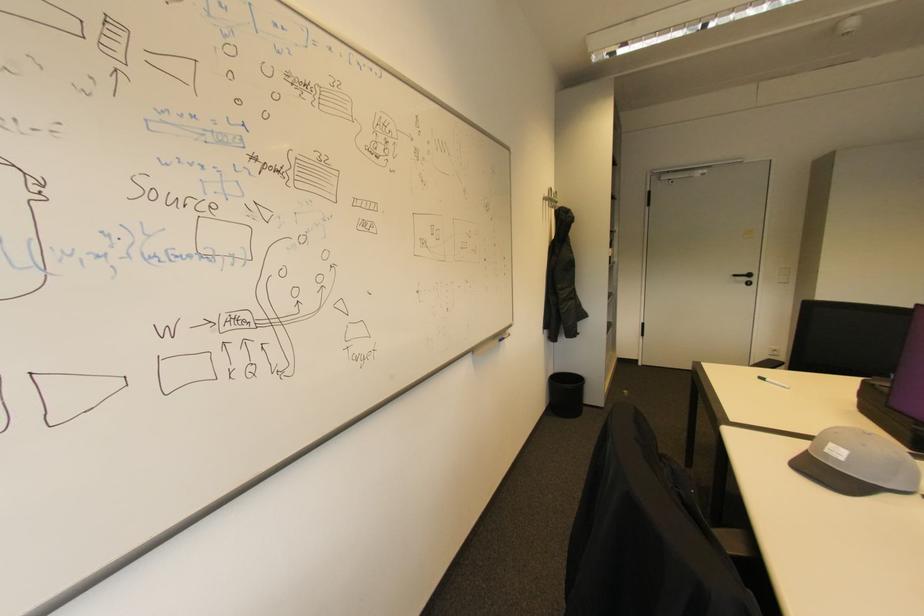
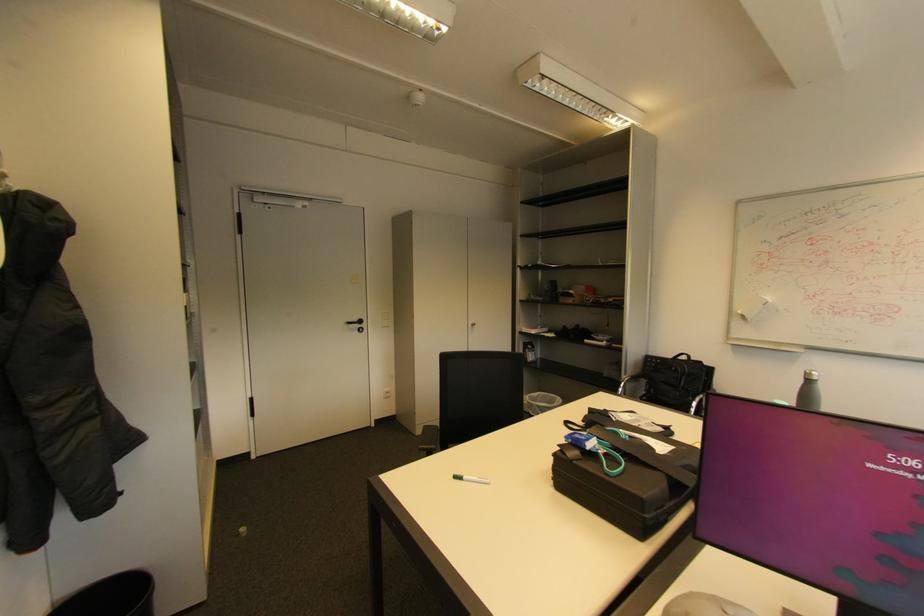
In the second image, find the point that corresponds to point (755, 276) in the first image.

(366, 322)